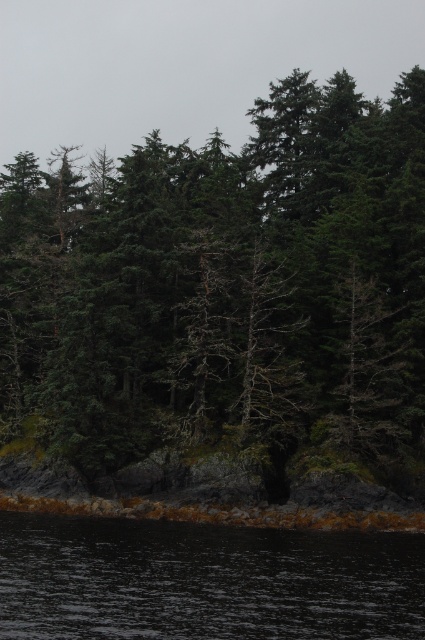
You are a hiker who wants to cross the dark water at lower center using a 30 meter long rope tied to the green matte tree at center. Can you safely reach the other side with the rope?

The distance between the green matte tree at center and dark water at lower center is 30.16 meters. The rope is only 30 meters long, so it is 16 centimeters short. Therefore, you cannot safely reach the other side with the rope.

You are a hiker standing on the rocky shoreline near the dark water at lower center. You notice the green matte tree at center in the distance. Which object is taller?

The green matte tree at center is taller than the dark water at lower center.